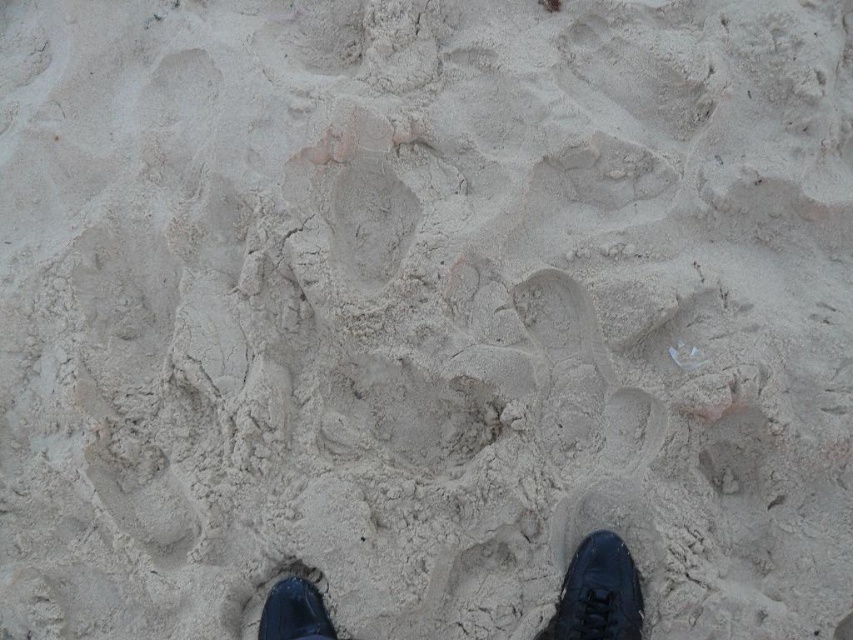
Question: Is black leather shoes at lower center positioned behind black leather shoe at lower right?

Choices:
 (A) yes
 (B) no

Answer: (A)

Question: Can you confirm if black leather shoe at lower right is wider than black leather shoe at lower left?

Choices:
 (A) no
 (B) yes

Answer: (B)

Question: Which object is closer to the camera taking this photo?

Choices:
 (A) black leather shoe at lower left
 (B) black leather shoes at lower center
 (C) black leather shoe at lower right

Answer: (C)

Question: Considering the real-world distances, which object is farthest from the black leather shoe at lower left?

Choices:
 (A) black leather shoe at lower right
 (B) black leather shoes at lower center

Answer: (B)

Question: Which of the following is the closest to the observer?

Choices:
 (A) black leather shoe at lower right
 (B) black leather shoes at lower center

Answer: (A)

Question: Is black leather shoes at lower center bigger than black leather shoe at lower right?

Choices:
 (A) no
 (B) yes

Answer: (A)